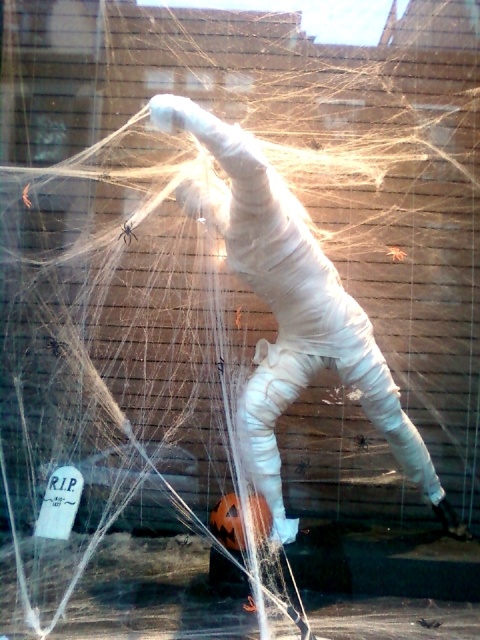
Question: Does white matte mummy at center have a greater width compared to black fuzzy spider at center?

Choices:
 (A) yes
 (B) no

Answer: (A)

Question: From the image, what is the correct spatial relationship of white matte mummy at center in relation to black fuzzy spider at center?

Choices:
 (A) right
 (B) left

Answer: (A)

Question: Which object appears closest to the camera in this image?

Choices:
 (A) black fuzzy spider at center
 (B) white matte mummy at center

Answer: (B)

Question: Is white matte mummy at center to the right of black fuzzy spider at center from the viewer's perspective?

Choices:
 (A) no
 (B) yes

Answer: (B)